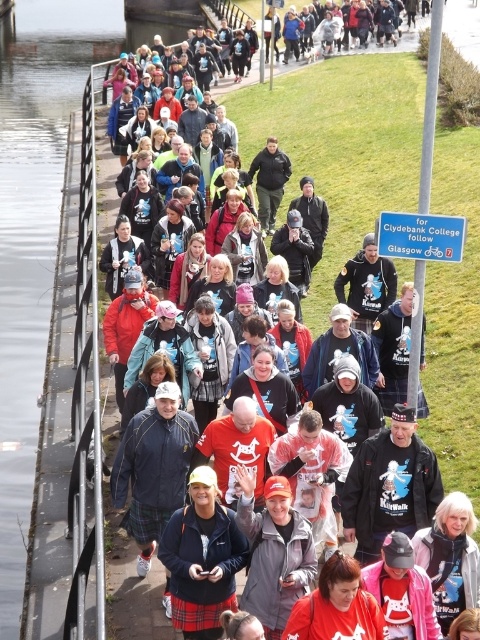
How much distance is there between smooth concrete waterway at left and plaid skirt at center?

They are 19.69 feet apart.

Who is lower down, smooth concrete waterway at left or plaid skirt at center?

plaid skirt at center is below.

This screenshot has width=480, height=640. I want to click on smooth concrete waterway at left, so click(34, 234).